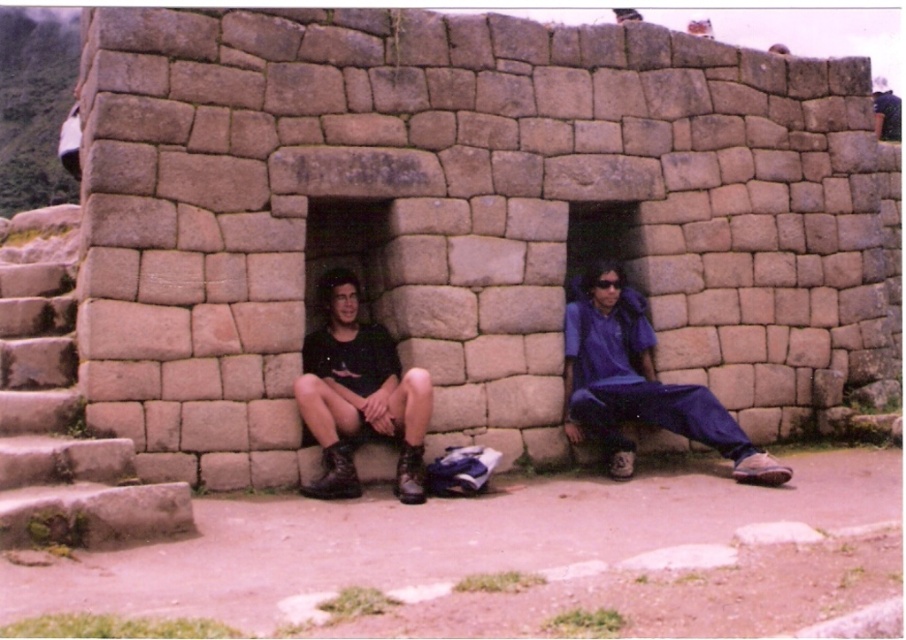
You are planning to buy a pair of pants and boots similar to those in the image. Based on the scene, which item has a greater width measurement between the blue fabric pants at right and the black matte boots at lower left?

The blue fabric pants at right has a greater width than the black matte boots at lower left according to the description.

You are standing in front of an ancient stone structure and see the dark blue fabric pants at center and the black matte boots at lower left. Which object is positioned more to the left?

The dark blue fabric pants at center is to the left of black matte boots at lower left, so the dark blue fabric pants at center is positioned more to the left.

You are a photographer trying to capture both the dark blue fabric pants at center and the blue fabric pants at right in a single frame. Based on their sizes, which pair of pants should you focus on to ensure they are clearly visible in the photo?

The dark blue fabric pants at center has a smaller size compared to blue fabric pants at right, so focusing on the blue fabric pants at right would ensure they are clearly visible in the photo due to their larger size.